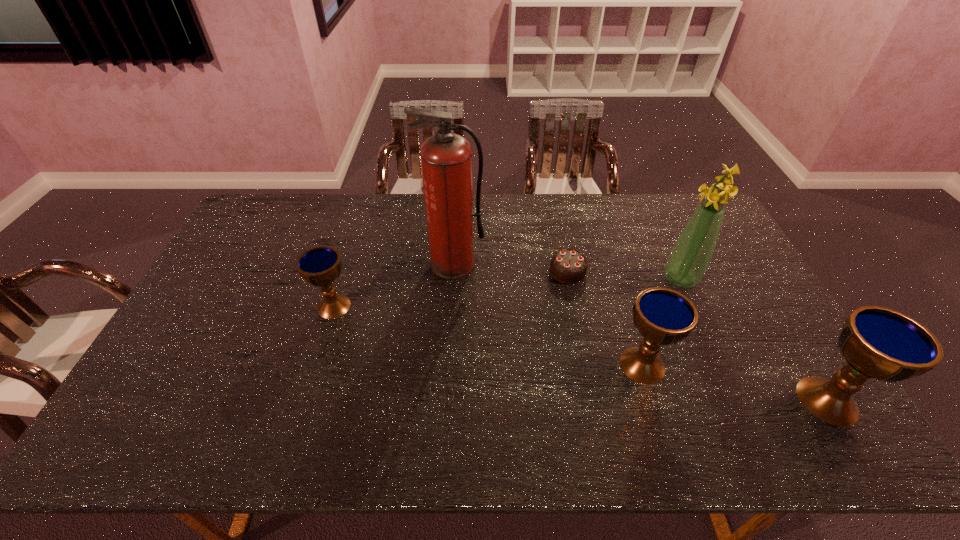
Find the location of a particular element. Image resolution: width=960 pixels, height=540 pixels. the fifth object from right to left is located at coordinates (446, 158).

At what (x,y) coordinates should I click in order to perform the action: click on vacant space located on the front of the second shortest object. Please return your answer as a coordinate pair (x, y). This screenshot has height=540, width=960. Looking at the image, I should click on (308, 389).

Locate an element on the screen. vacant area located on the left of the third shortest object is located at coordinates (524, 365).

Locate an element on the screen. blank space located on the back of the rightmost object is located at coordinates coord(763,295).

What are the coordinates of `vacant space located on the front-facing side of the fifth shortest object` in the screenshot? It's located at (555, 279).

Identify the location of free space located on the front-facing side of the fifth shortest object. This screenshot has width=960, height=540. (615, 279).

This screenshot has width=960, height=540. I want to click on vacant point located 0.060m on the front-facing side of the fifth shortest object, so click(x=644, y=279).

Identify the location of free space located on the front of the shortest object. The width and height of the screenshot is (960, 540). (585, 356).

At what (x,y) coordinates should I click in order to perform the action: click on vacant region located at the nozzle of the second object from left to right. Please return your answer as a coordinate pair (x, y). The width and height of the screenshot is (960, 540). Looking at the image, I should click on (450, 322).

Find the location of a particular element. The image size is (960, 540). object that is at the right edge is located at coordinates [x=877, y=342].